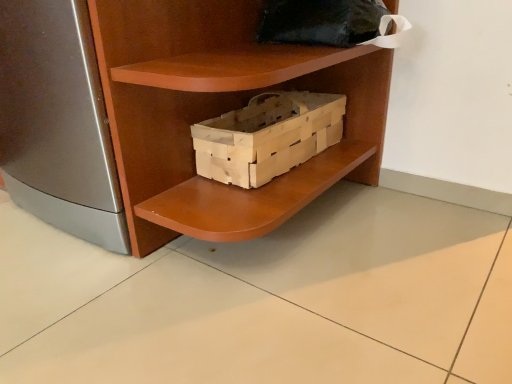
At what (x,y) coordinates should I click in order to perform the action: click on wooden crate at center. Please return your answer as a coordinate pair (x, y). Looking at the image, I should click on pos(267,136).

Where is `wooden crate at center`? wooden crate at center is located at coordinates [215, 115].

From a real-world perspective, which object stands above the other?

wooden crate at center.

Measure the distance between wooden crate at center and wooden crate at center.

The distance of wooden crate at center from wooden crate at center is 4.00 inches.

From the image's perspective, would you say wooden crate at center is positioned over wooden crate at center?

Yes, from the image's perspective, wooden crate at center is on top of wooden crate at center.

Are wooden crate at center and wooden crate at center making contact?

wooden crate at center and wooden crate at center are clearly separated.

Does wooden crate at center have a smaller size compared to black fabric pillow at upper center?

Actually, wooden crate at center might be larger than black fabric pillow at upper center.

Considering the relative sizes of wooden crate at center and black fabric pillow at upper center in the image provided, is wooden crate at center shorter than black fabric pillow at upper center?

Incorrect, the height of wooden crate at center does not fall short of that of black fabric pillow at upper center.

From a real-world perspective, is wooden crate at center beneath black fabric pillow at upper center?

Indeed, from a real-world perspective, wooden crate at center is positioned beneath black fabric pillow at upper center.

Choose the correct answer: Is wooden crate at center inside black fabric pillow at upper center or outside it?

The correct answer is: outside.

The height and width of the screenshot is (384, 512). In order to click on shelf to the left of wooden crate at center in this screenshot , I will do `click(215, 115)`.

From the image's perspective, would you say wooden crate at center is shown under wooden crate at center?

Indeed, from the image's perspective, wooden crate at center is shown beneath wooden crate at center.

Is wooden crate at center inside wooden crate at center?

Definitely not — wooden crate at center is not inside wooden crate at center.

Is wooden crate at center facing away from wooden crate at center?

That's right, wooden crate at center is facing away from wooden crate at center.

Which of these two, black fabric pillow at upper center or wooden crate at center, is smaller?

black fabric pillow at upper center.

Is black fabric pillow at upper center next to wooden crate at center and touching it?

No, black fabric pillow at upper center is not with wooden crate at center.

Does black fabric pillow at upper center contain wooden crate at center?

No, black fabric pillow at upper center does not contain wooden crate at center.

In the image, is black fabric pillow at upper center on the left side or the right side of wooden crate at center?

Based on their positions, black fabric pillow at upper center is located to the right of wooden crate at center.

From a real-world perspective, is black fabric pillow at upper center located beneath wooden crate at center?

Actually, black fabric pillow at upper center is physically above wooden crate at center in the real world.

Does black fabric pillow at upper center have a larger size compared to wooden crate at center?

Actually, black fabric pillow at upper center might be smaller than wooden crate at center.

Between point (371, 23) and point (195, 128), which one is positioned behind?

The point (195, 128) is farther.

What are the coordinates of `box located below the black fabric pillow at upper center (from the image's perspective)` in the screenshot? It's located at (267, 136).

Is wooden crate at center completely or partially outside of black fabric pillow at upper center?

Yes.

What's the angular difference between wooden crate at center and black fabric pillow at upper center's facing directions?

The facing directions of wooden crate at center and black fabric pillow at upper center are 1.26 degrees apart.

From a real-world perspective, between wooden crate at center and black fabric pillow at upper center, who is vertically lower?

wooden crate at center, from a real-world perspective.

Locate an element on the screen. shelf above the wooden crate at center (from a real-world perspective) is located at coordinates (215, 115).

Image resolution: width=512 pixels, height=384 pixels. Find the location of `pillow located on the right of wooden crate at center`. pillow located on the right of wooden crate at center is located at coordinates (321, 22).

Estimate the real-world distances between objects in this image. Which object is closer to wooden crate at center, wooden crate at center or black fabric pillow at upper center?

wooden crate at center is closer to wooden crate at center.

Which object lies nearer to the anchor point black fabric pillow at upper center, wooden crate at center or wooden crate at center?

wooden crate at center is closer to black fabric pillow at upper center.

Based on their spatial positions, is black fabric pillow at upper center or wooden crate at center closer to wooden crate at center?

wooden crate at center lies closer to wooden crate at center than the other object.

Based on their spatial positions, is wooden crate at center or wooden crate at center closer to black fabric pillow at upper center?

The object closer to black fabric pillow at upper center is wooden crate at center.

Which object lies nearer to the anchor point wooden crate at center, black fabric pillow at upper center or wooden crate at center?

The object closer to wooden crate at center is wooden crate at center.

Based on their spatial positions, is wooden crate at center or black fabric pillow at upper center closer to wooden crate at center?

wooden crate at center.

I want to click on box between wooden crate at center and black fabric pillow at upper center, so click(x=267, y=136).